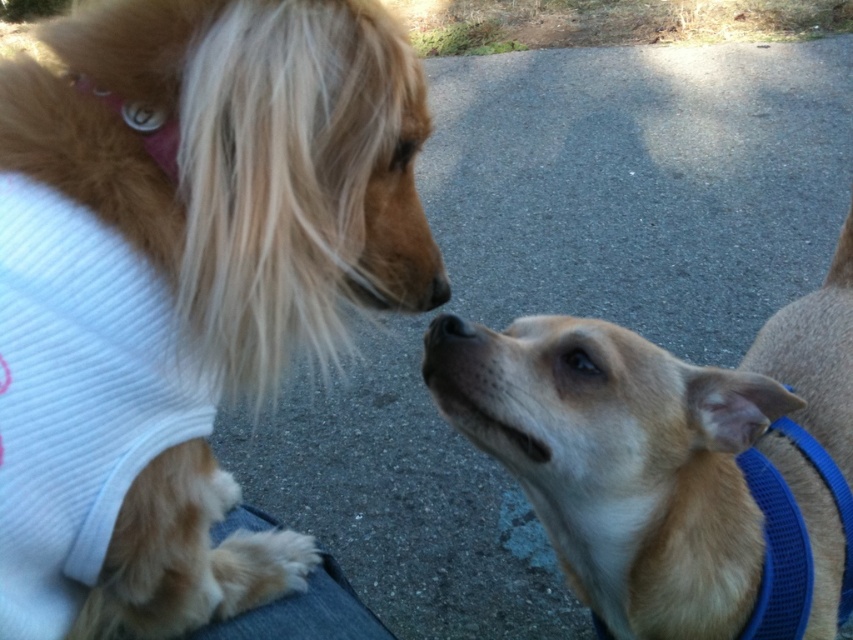
You are a photographer trying to capture the soft golden fur at upper left. Based on the scene description, where should you position your camera to ensure it is centered in your shot?

The soft golden fur at upper left is located at point [238,163], so position your camera to center the shot at those coordinates.

You are a dog owner who wants to separate your two dogs to prevent them from fighting. The dogs are the soft golden fur at upper left and light brown fur at center. If you have a 12 inch long leash, can you safely keep them apart using the leash?

The distance between the soft golden fur at upper left and light brown fur at center is 14.07 inches. Since the leash is only 12 inches long, it is not long enough to keep them apart at that distance. You would need a longer leash to maintain separation.

You are a dog owner trying to separate two dogs during their interaction. The dogs are the soft golden fur at upper left and the light brown fur at center. Which dog should you approach first to prevent them from getting too close?

You should approach the soft golden fur at upper left first because it is positioned over the light brown fur at center, meaning it is closer to you and easier to reach.